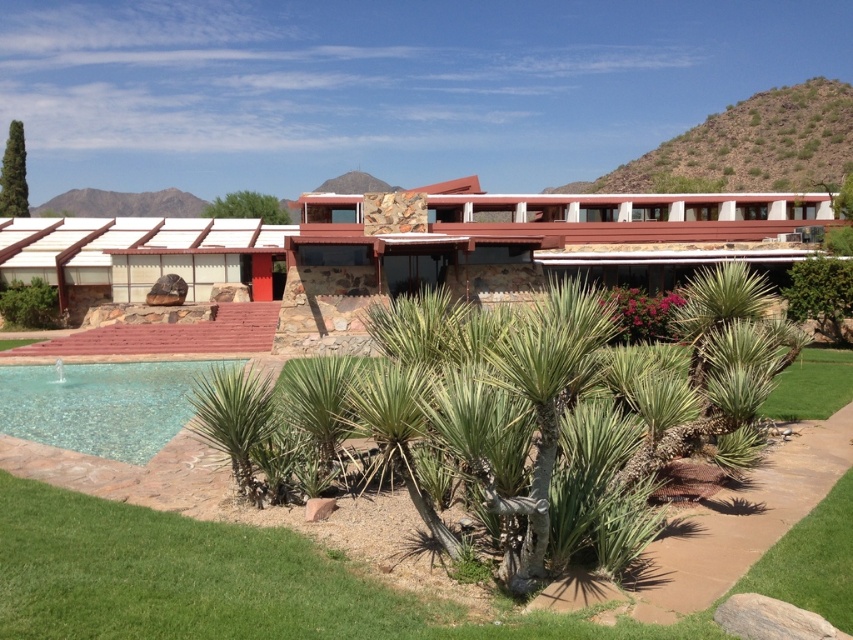
You are standing at the center of the image and want to locate the point marked at coordinates (541,413). Which object in the scene contains this point?

The point marked at coordinates (541,413) is located on the green spiky palm tree at center.

You are designing a garden layout and need to place two green spiky palm trees. The scene shows a green spiky palm tree at center and a green spiky palm tree at lower center. Which of these two trees requires more space in the garden?

The green spiky palm tree at lower center requires more space in the garden because it occupies more space than the green spiky palm tree at center.